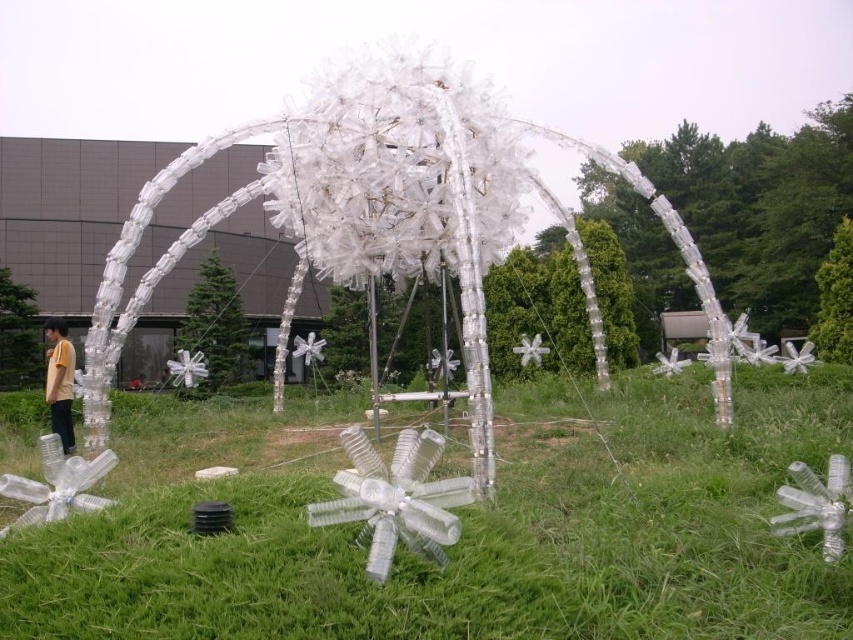
Question: Is transparent plastic flower at center smaller than yellow matte shirt at lower left?

Choices:
 (A) yes
 (B) no

Answer: (A)

Question: Is the position of transparent plastic flower at center less distant than that of yellow matte shirt at lower left?

Choices:
 (A) no
 (B) yes

Answer: (B)

Question: Which point appears closest to the camera in this image?

Choices:
 (A) (54, 342)
 (B) (786, 548)

Answer: (B)

Question: Can you confirm if transparent plastic flower at center is bigger than yellow matte shirt at lower left?

Choices:
 (A) yes
 (B) no

Answer: (B)

Question: Among these objects, which one is nearest to the camera?

Choices:
 (A) transparent plastic flower at center
 (B) transparent plastic sculpture at center
 (C) yellow matte shirt at lower left

Answer: (A)

Question: Among these points, which one is farthest from the camera?

Choices:
 (A) (47, 372)
 (B) (456, 556)

Answer: (A)